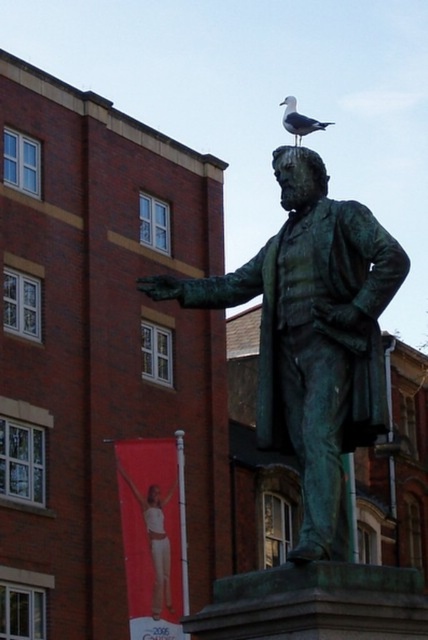
Does green patina statue at center appear under white feathered bird at statue top?

Correct, green patina statue at center is located below white feathered bird at statue top.

Between green patina statue at center and white feathered bird at statue top, which one is positioned lower?

Positioned lower is green patina statue at center.

Locate an element on the screen. This screenshot has width=428, height=640. green patina statue at center is located at coordinates (312, 336).

Where is `green patina statue at center`? This screenshot has width=428, height=640. green patina statue at center is located at coordinates (312, 336).